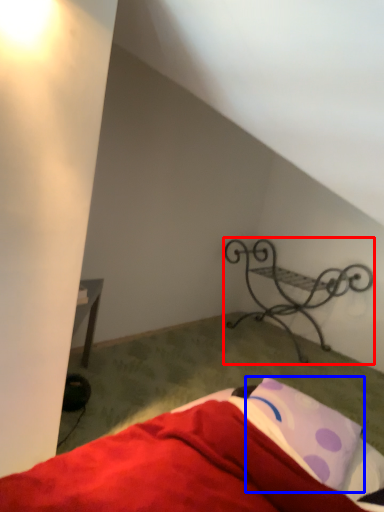
Question: Which object is further to the camera taking this photo, furniture (highlighted by a red box) or pillow (highlighted by a blue box)?

Choices:
 (A) furniture
 (B) pillow

Answer: (A)